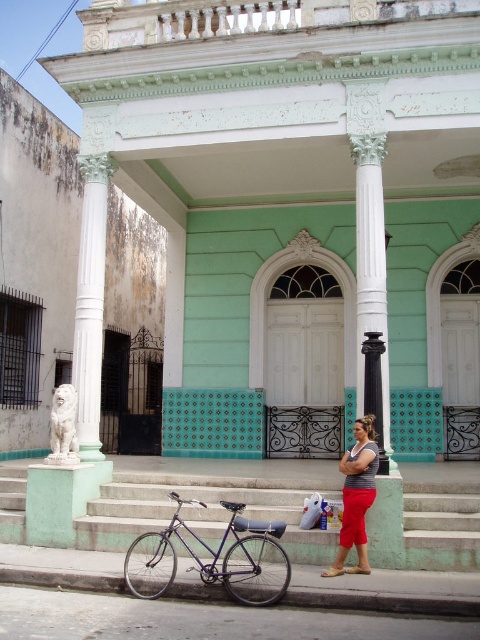
Question: Is smooth concrete stairs at center above gray striped tank top at center?

Choices:
 (A) no
 (B) yes

Answer: (A)

Question: Among these objects, which one is farthest from the camera?

Choices:
 (A) smooth concrete stairs at center
 (B) shiny blue bicycle at lower left

Answer: (A)

Question: Which point is closer to the camera?

Choices:
 (A) [260, 576]
 (B) [1, 497]
 (C) [361, 426]
 (D) [99, 323]

Answer: (A)

Question: Is white marble column at center behind gray striped tank top at center?

Choices:
 (A) yes
 (B) no

Answer: (A)

Question: Which point is farther from the camera taking this photo?

Choices:
 (A) (362, 445)
 (B) (476, 536)
 (C) (233, 593)
 (D) (94, 273)

Answer: (D)

Question: Does shiny blue bicycle at lower left lie behind white marble column at center?

Choices:
 (A) no
 (B) yes

Answer: (A)